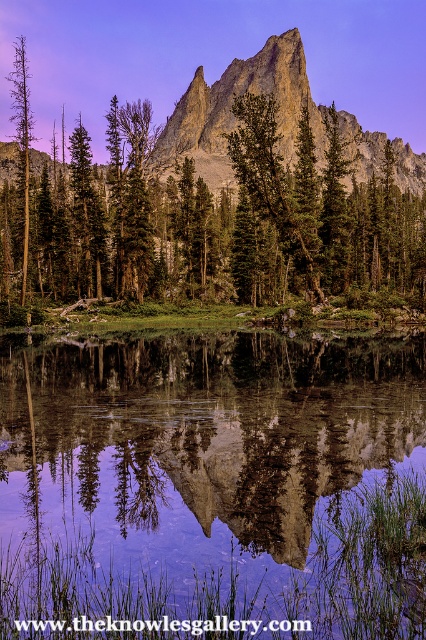
Question: Does rugged granite peak at center have a lesser width compared to green matte tree at left?

Choices:
 (A) no
 (B) yes

Answer: (A)

Question: Which point is farther to the camera?

Choices:
 (A) (66, 237)
 (B) (23, 182)
 (C) (52, 611)

Answer: (B)

Question: Which of the following is the closest to the observer?

Choices:
 (A) (247, 403)
 (B) (181, 134)

Answer: (A)

Question: From the image, what is the correct spatial relationship of clear glass water at center in relation to rugged granite peak at center?

Choices:
 (A) right
 (B) left

Answer: (B)

Question: Does clear glass water at center appear over green matte tree at left?

Choices:
 (A) no
 (B) yes

Answer: (A)

Question: Estimate the real-world distances between objects in this image. Which object is farther from the rugged granite peak at center?

Choices:
 (A) clear glass water at center
 (B) green matte tree at center

Answer: (A)